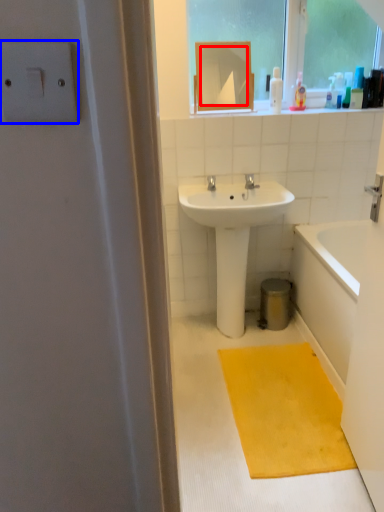
Question: Which object appears farthest to the camera in this image, mirror (highlighted by a red box) or light switch (highlighted by a blue box)?

Choices:
 (A) mirror
 (B) light switch

Answer: (A)